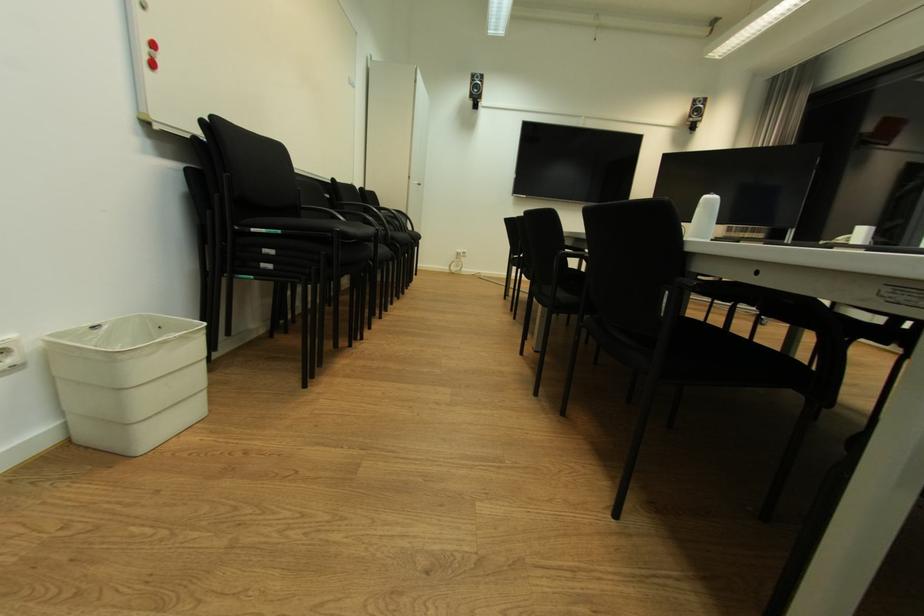
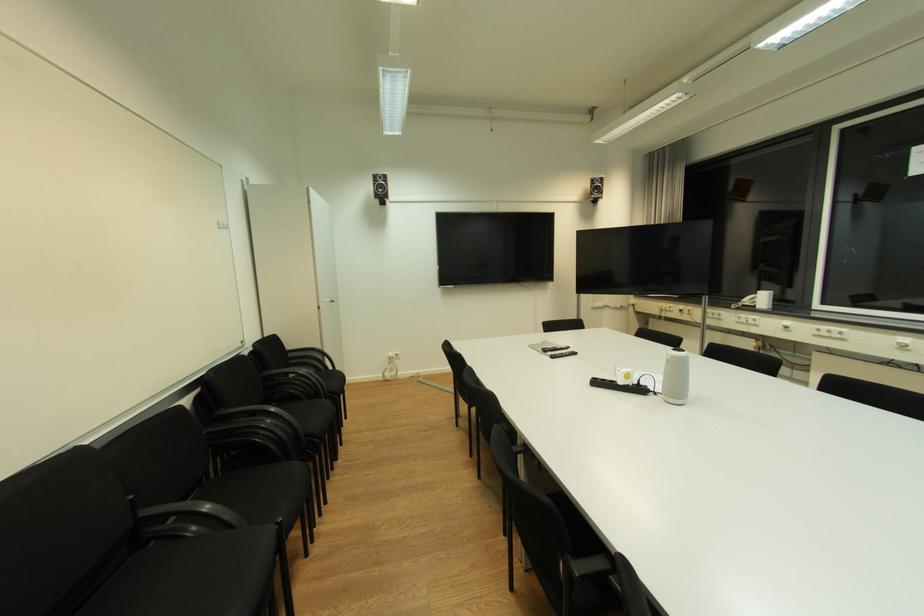
Find the pixel in the second image that matches pixel 421 182 in the first image.

(334, 301)